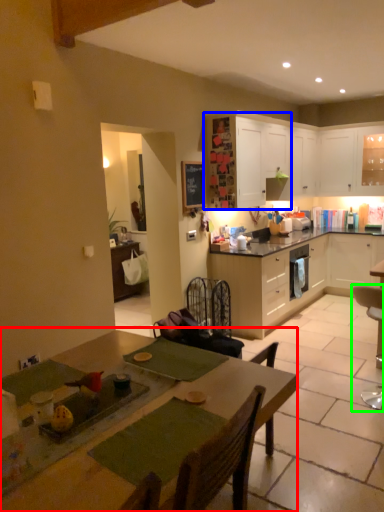
Question: Based on their relative distances, which object is nearer to table (highlighted by a red box)? Choose from cabinetry (highlighted by a blue box) and chair (highlighted by a green box).

Choices:
 (A) cabinetry
 (B) chair

Answer: (B)